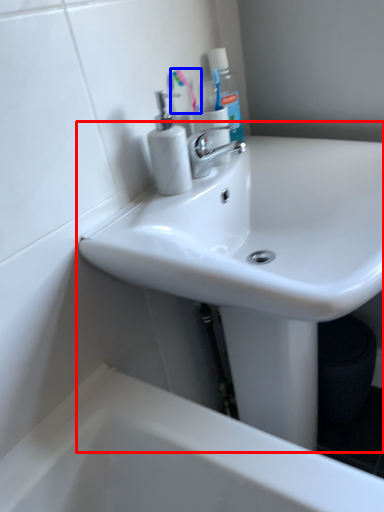
Question: Which of the following is the closest to the observer, sink (highlighted by a red box) or toothbrush (highlighted by a blue box)?

Choices:
 (A) sink
 (B) toothbrush

Answer: (A)